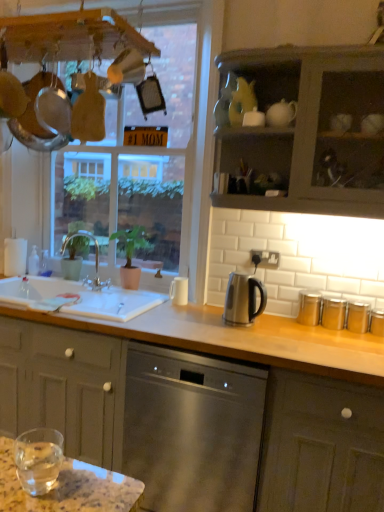
Question: Does white matte cup at center have a lesser height compared to satin silver kettle at center?

Choices:
 (A) yes
 (B) no

Answer: (A)

Question: Is white matte cup at center outside of satin silver kettle at center?

Choices:
 (A) yes
 (B) no

Answer: (A)

Question: Does white matte cup at center have a smaller size compared to satin silver kettle at center?

Choices:
 (A) yes
 (B) no

Answer: (A)

Question: Does white matte cup at center have a greater width compared to satin silver kettle at center?

Choices:
 (A) yes
 (B) no

Answer: (B)

Question: From a real-world perspective, is white matte cup at center under satin silver kettle at center?

Choices:
 (A) no
 (B) yes

Answer: (B)

Question: Does white matte cup at center appear on the left side of satin silver kettle at center?

Choices:
 (A) no
 (B) yes

Answer: (B)

Question: Considering the relative positions of brushed metal faucet at sink left and stainless steel dishwasher at center in the image provided, is brushed metal faucet at sink left to the left of stainless steel dishwasher at center from the viewer's perspective?

Choices:
 (A) no
 (B) yes

Answer: (B)

Question: Is brushed metal faucet at sink left outside stainless steel dishwasher at center?

Choices:
 (A) no
 (B) yes

Answer: (B)

Question: From the image's perspective, would you say brushed metal faucet at sink left is shown under stainless steel dishwasher at center?

Choices:
 (A) yes
 (B) no

Answer: (B)

Question: Does brushed metal faucet at sink left appear on the right side of stainless steel dishwasher at center?

Choices:
 (A) no
 (B) yes

Answer: (A)

Question: Considering the relative sizes of brushed metal faucet at sink left and stainless steel dishwasher at center in the image provided, is brushed metal faucet at sink left taller than stainless steel dishwasher at center?

Choices:
 (A) yes
 (B) no

Answer: (B)

Question: From the image's perspective, is brushed metal faucet at sink left above stainless steel dishwasher at center?

Choices:
 (A) yes
 (B) no

Answer: (A)

Question: Considering the relative sizes of matte gray cabinet at lower right, the first cabinetry from the bottom, and clear glass water at lower left in the image provided, is matte gray cabinet at lower right, the first cabinetry from the bottom, bigger than clear glass water at lower left?

Choices:
 (A) yes
 (B) no

Answer: (A)